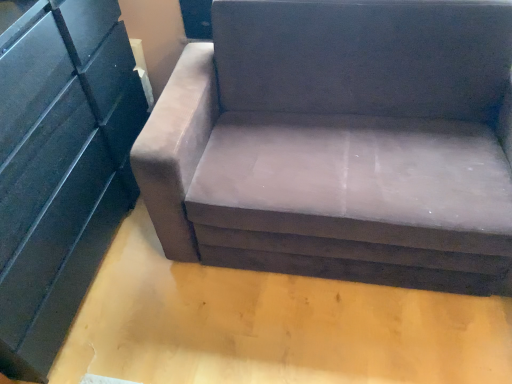
In order to face suede-like brown couch at center, should I rotate leftwards or rightwards?

Rotate your view right by about 12.434°.

What do you see at coordinates (339, 143) in the screenshot?
I see `suede-like brown couch at center` at bounding box center [339, 143].

Identify the location of suede-like brown couch at center. (339, 143).

This screenshot has height=384, width=512. What do you see at coordinates (61, 168) in the screenshot?
I see `matte black dresser at left` at bounding box center [61, 168].

At what (x,y) coordinates should I click in order to perform the action: click on matte black dresser at left. Please return your answer as a coordinate pair (x, y). The width and height of the screenshot is (512, 384). Looking at the image, I should click on (61, 168).

Identify the location of suede-like brown couch at center. (339, 143).

Considering the positions of objects matte black dresser at left and suede-like brown couch at center in the image provided, who is more to the left, matte black dresser at left or suede-like brown couch at center?

Positioned to the left is matte black dresser at left.

Considering their positions, is matte black dresser at left located in front of or behind suede-like brown couch at center?

matte black dresser at left is positioned closer to the viewer than suede-like brown couch at center.

Considering the positions of point (120, 91) and point (467, 116), is point (120, 91) closer or farther from the camera than point (467, 116)?

Point (120, 91) is positioned farther from the camera compared to point (467, 116).

From the image's perspective, is matte black dresser at left beneath suede-like brown couch at center?

Correct, matte black dresser at left appears lower than suede-like brown couch at center in the image.

Consider the image. From a real-world perspective, who is located higher, matte black dresser at left or suede-like brown couch at center?

matte black dresser at left is physically above.

Is matte black dresser at left thinner than suede-like brown couch at center?

Indeed, matte black dresser at left has a lesser width compared to suede-like brown couch at center.

Considering the relative sizes of matte black dresser at left and suede-like brown couch at center in the image provided, is matte black dresser at left shorter than suede-like brown couch at center?

No, matte black dresser at left is not shorter than suede-like brown couch at center.

Is matte black dresser at left bigger than suede-like brown couch at center?

Incorrect, matte black dresser at left is not larger than suede-like brown couch at center.

Is matte black dresser at left not within suede-like brown couch at center?

Yes, matte black dresser at left is outside of suede-like brown couch at center.

Is matte black dresser at left not near suede-like brown couch at center?

They are positioned close to each other.

Is matte black dresser at left oriented away from suede-like brown couch at center?

matte black dresser at left is not turned away from suede-like brown couch at center.

What's the angular difference between matte black dresser at left and suede-like brown couch at center's facing directions?

matte black dresser at left and suede-like brown couch at center are facing 90.9 degrees away from each other.

You are a GUI agent. You are given a task and a screenshot of the screen. Output one action in this format:
    pyautogui.click(x=<x>, y=<y>)
    Task: Click on the studio couch behind the matte black dresser at left
    
    Given the screenshot: What is the action you would take?
    pyautogui.click(x=339, y=143)

In the scene shown: Considering the positions of objects suede-like brown couch at center and matte black dresser at left in the image provided, who is more to the right, suede-like brown couch at center or matte black dresser at left?

suede-like brown couch at center.

Does suede-like brown couch at center lie behind matte black dresser at left?

Yes, the depth of suede-like brown couch at center is greater than that of matte black dresser at left.

Does point (293, 40) lie behind point (7, 171)?

Yes, it is behind point (7, 171).

From the image's perspective, is suede-like brown couch at center on top of matte black dresser at left?

Yes, from the image's perspective, suede-like brown couch at center is above matte black dresser at left.

From a real-world perspective, is suede-like brown couch at center under matte black dresser at left?

Yes, from a real-world perspective, suede-like brown couch at center is under matte black dresser at left.

Which object is wider, suede-like brown couch at center or matte black dresser at left?

suede-like brown couch at center is wider.

Between suede-like brown couch at center and matte black dresser at left, which one has more height?

With more height is matte black dresser at left.

Is suede-like brown couch at center bigger than matte black dresser at left?

Yes.

Is suede-like brown couch at center completely or partially outside of matte black dresser at left?

Yes, suede-like brown couch at center is located beyond the bounds of matte black dresser at left.

Are suede-like brown couch at center and matte black dresser at left located far from each other?

They are positioned close to each other.

Could you tell me if suede-like brown couch at center is facing matte black dresser at left?

No, suede-like brown couch at center is not oriented towards matte black dresser at left.

Consider the image. What's the angular difference between suede-like brown couch at center and matte black dresser at left's facing directions?

The angle between the facing direction of suede-like brown couch at center and the facing direction of matte black dresser at left is 90.9 degrees.

How distant is suede-like brown couch at center from matte black dresser at left?

suede-like brown couch at center is 28.21 inches away from matte black dresser at left.

You are a GUI agent. You are given a task and a screenshot of the screen. Output one action in this format:
    pyautogui.click(x=<x>, y=<y>)
    Task: Click on the dresser above the suede-like brown couch at center (from a real-world perspective)
    The width and height of the screenshot is (512, 384).
    Given the screenshot: What is the action you would take?
    pyautogui.click(x=61, y=168)

Locate an element on the screen. The image size is (512, 384). studio couch that is above the matte black dresser at left (from the image's perspective) is located at coordinates coord(339,143).

Locate an element on the screen. This screenshot has width=512, height=384. dresser on the left of suede-like brown couch at center is located at coordinates (61, 168).